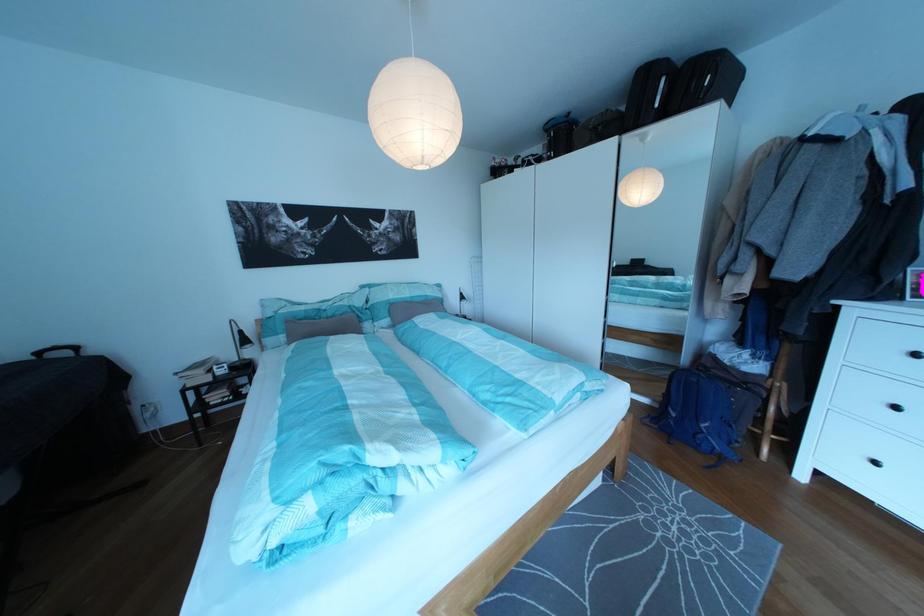
Find where to lift the blue backpack. Please return your answer as a coordinate pair (x, y).

(699, 414)